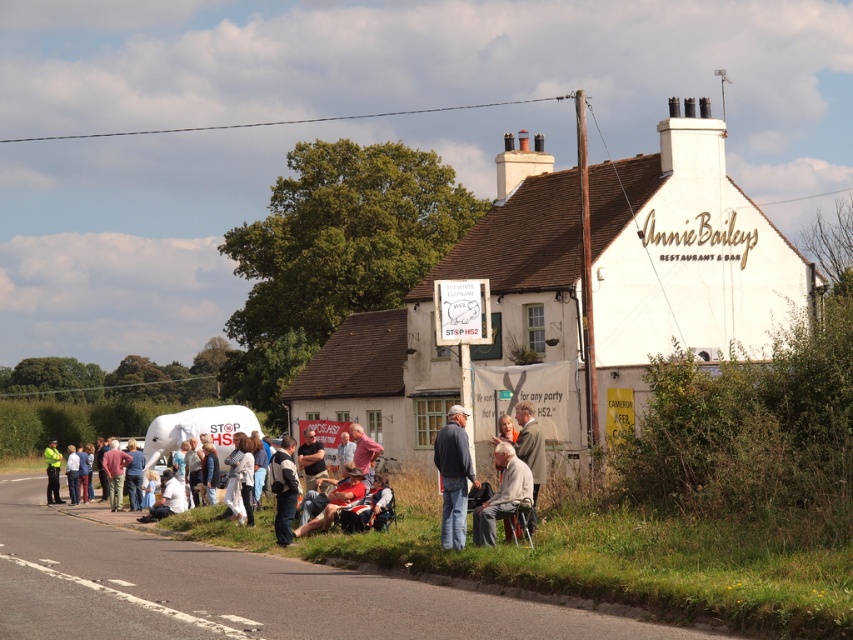
Question: Is light gray fabric jacket at center positioned in front of green uniformed person at lower left?

Choices:
 (A) no
 (B) yes

Answer: (B)

Question: Which point appears farthest from the camera in this image?

Choices:
 (A) (291, 513)
 (B) (541, 445)
 (C) (519, 476)

Answer: (A)

Question: From the image, what is the correct spatial relationship of light gray fabric jacket at center in relation to green uniformed person at lower left?

Choices:
 (A) right
 (B) left

Answer: (A)

Question: Among these objects, which one is nearest to the camera?

Choices:
 (A) light beige fabric chair at lower center
 (B) light gray fabric jacket at center
 (C) green uniformed person at lower left

Answer: (A)

Question: Which of the following is the closest to the observer?

Choices:
 (A) (51, 486)
 (B) (281, 538)
 (C) (462, 445)
 (D) (537, 483)

Answer: (C)

Question: Does denim jacket at center lie behind light gray fabric jacket at center?

Choices:
 (A) yes
 (B) no

Answer: (B)